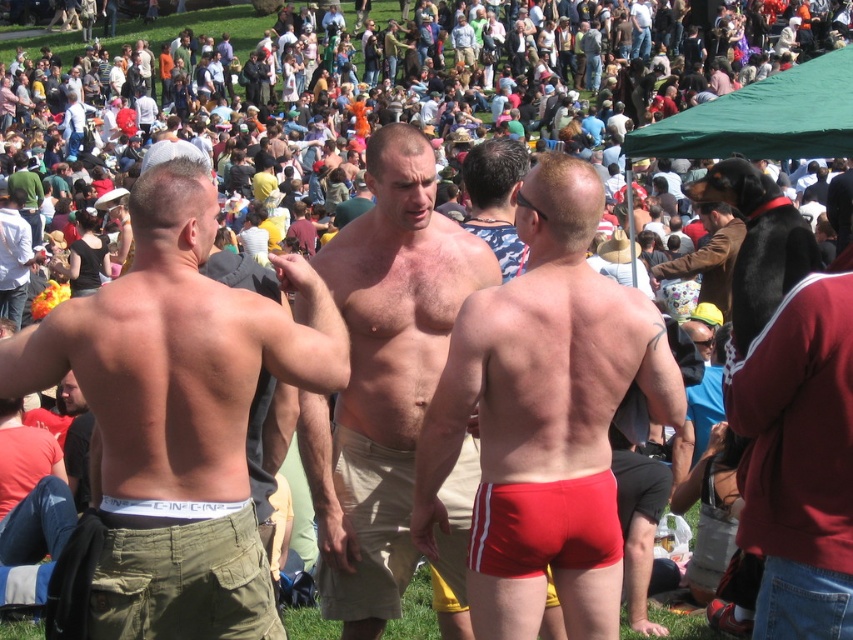
You are a photographer at this event and want to capture a clear shot of the red matte boxer shorts at center without the green fabric canopy at upper right blocking it. Based on their positions, is this possible?

Yes, since the red matte boxer shorts at center is in front of the green fabric canopy at upper right, it won not be blocked by the canopy and can be captured clearly.

You are at an outdoor event and want to take a photo of the two points marked in the scene. Which point, point 1 at coordinates point [540,192] or point 2 at coordinates point [809,74], will appear larger in your photo?

Point 1 at coordinates point [540,192] will appear larger in the photo because it is closer to the viewer than point 2 at coordinates point [809,74].

Looking at this image, you are a photographer at the event and want to capture a closeup of the white matte underwear at center and tan khaki shorts at center. Since you can only focus on one item at a time, which one should you choose to ensure it appears clearer in the photo?

The white matte underwear at center is larger in size than tan khaki shorts at center, so you should focus on the white matte underwear at center to ensure it appears clearer in the photo.